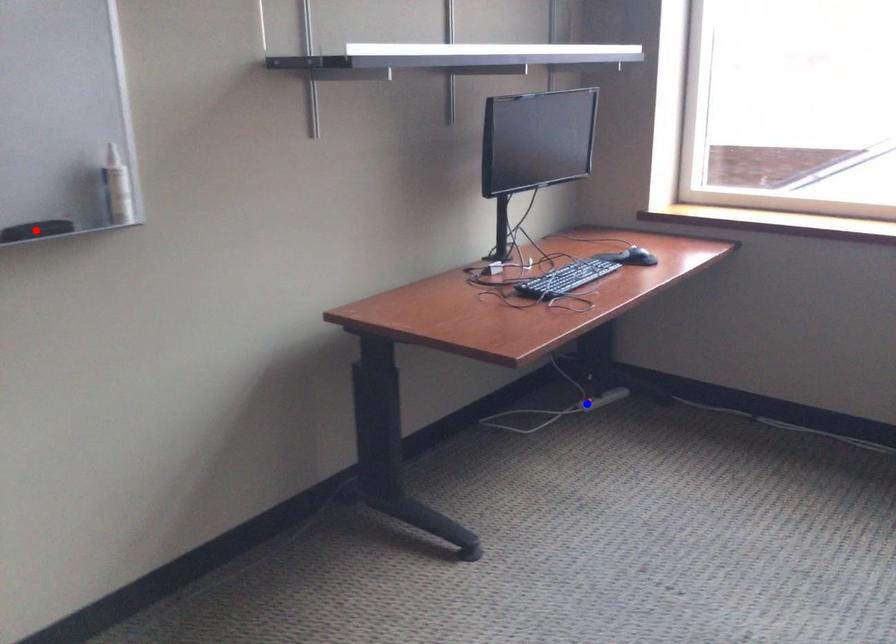
Question: In the image, two points are highlighted. Which point is nearer to the camera? Reply with the corresponding letter.

Choices:
 (A) blue point
 (B) red point

Answer: (B)